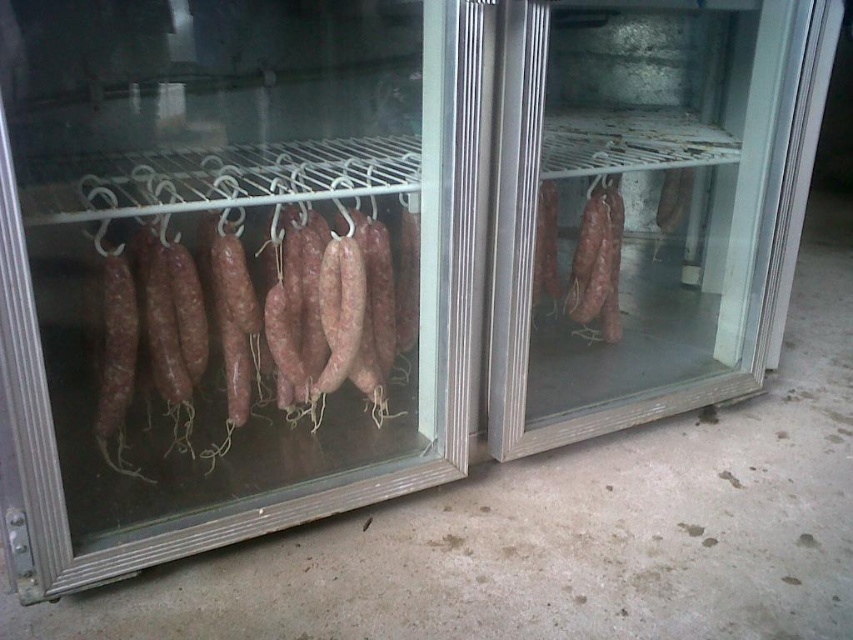
You are a customer looking at the refrigerators in the deli. You want to open the transparent glass door at center to see the sausages inside. Can you open it without moving the transparent glass door at left first?

The transparent glass door at left is in front of transparent glass door at center, so you need to move the transparent glass door at left out of the way first before you can access and open the transparent glass door at center.